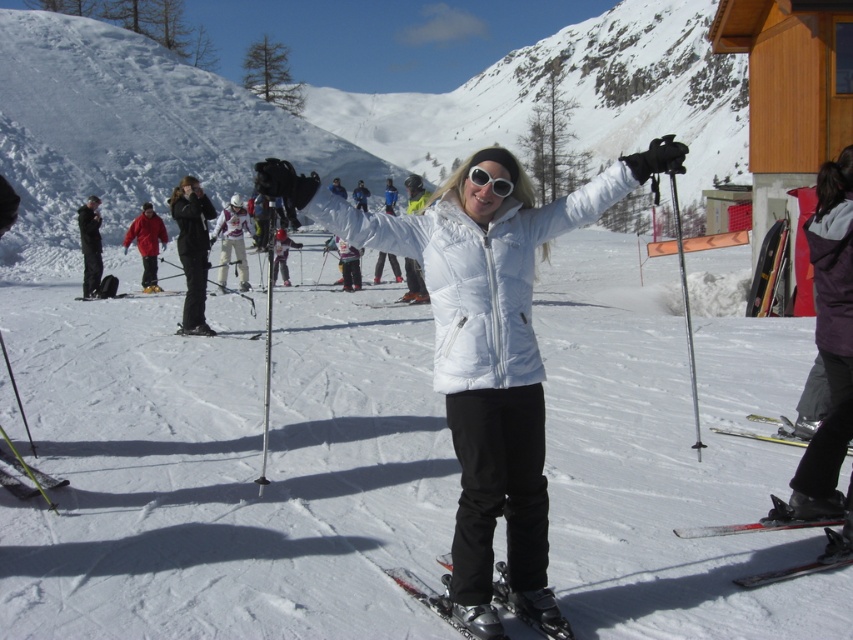
Question: Can you confirm if white ski suit at center is bigger than white snowsuit at center?

Choices:
 (A) yes
 (B) no

Answer: (B)

Question: Is white snowsuit at center thinner than yellow metallic ski at lower right?

Choices:
 (A) yes
 (B) no

Answer: (A)

Question: Which of the following is the closest to the observer?

Choices:
 (A) (258, 332)
 (B) (144, 284)
 (C) (769, 573)
 (D) (717, 429)

Answer: (C)

Question: Which of the following is the closest to the observer?

Choices:
 (A) (405, 300)
 (B) (447, 582)

Answer: (B)

Question: Which of the following is the closest to the observer?

Choices:
 (A) yellow metallic ski at lower right
 (B) metallic skis at center
 (C) red jacket at center

Answer: (B)

Question: Is red metallic ski at lower right smaller than white plastic ski at center?

Choices:
 (A) yes
 (B) no

Answer: (A)